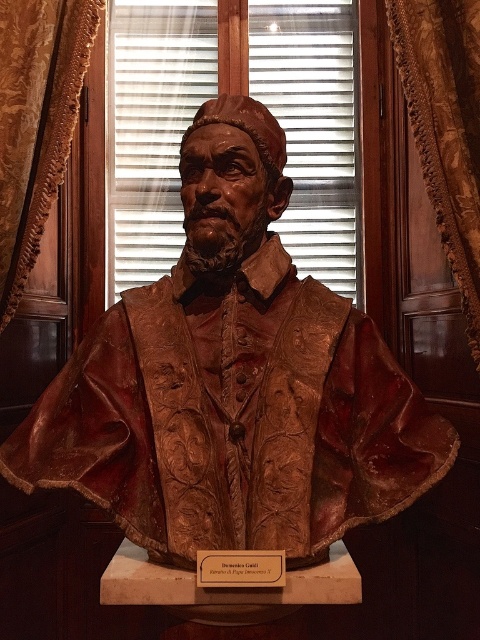
Does brown textured curtain at left have a lesser width compared to matte gold plaque at center?

Incorrect, brown textured curtain at left's width is not less than matte gold plaque at center's.

Who is more forward, (41, 32) or (238, 570)?

Point (238, 570)

Does point (36, 188) come in front of point (220, 550)?

No, it is behind (220, 550).

Find the location of `brown textured curtain at left`. brown textured curtain at left is located at coordinates [x=36, y=122].

Does white blinds at center have a smaller size compared to velvet drapery at right?

Actually, white blinds at center might be larger than velvet drapery at right.

Which is above, white blinds at center or velvet drapery at right?

white blinds at center is above.

Measure the distance between white blinds at center and camera.

white blinds at center is 2.18 meters from camera.

Locate an element on the screen. This screenshot has width=480, height=640. white blinds at center is located at coordinates (152, 128).

Which is in front, point (175, 168) or point (4, 266)?

Point (4, 266) is more forward.

Who is more distant from viewer, (162, 145) or (59, 76)?

The point (162, 145) is more distant.

This screenshot has height=640, width=480. I want to click on white blinds at center, so click(x=152, y=128).